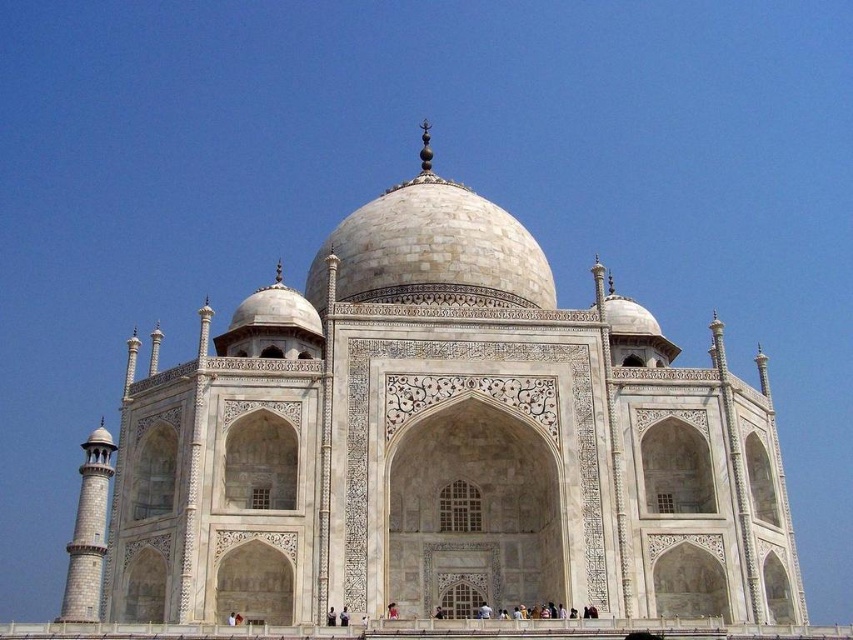
Looking at this image, which is more to the left, white marble taj mahal at center or red fabric person at center?

From the viewer's perspective, white marble taj mahal at center appears more on the left side.

Consider the image. Which is below, white marble taj mahal at center or red fabric person at center?

red fabric person at center is below.

The width and height of the screenshot is (853, 640). I want to click on white marble taj mahal at center, so click(x=434, y=445).

Which of these two, white marble taj mahal at center or smooth white person at center, stands taller?

white marble taj mahal at center

Can you confirm if white marble taj mahal at center is positioned below smooth white person at center?

Incorrect, white marble taj mahal at center is not positioned below smooth white person at center.

Is point (653, 584) positioned after point (339, 612)?

Yes, point (653, 584) is farther from viewer.

Locate an element on the screen. This screenshot has height=640, width=853. white marble taj mahal at center is located at coordinates (434, 445).

Is red fabric person at center above smooth white person at center?

No, red fabric person at center is not above smooth white person at center.

Who is positioned more to the right, red fabric person at center or smooth white person at center?

From the viewer's perspective, red fabric person at center appears more on the right side.

Describe the element at coordinates (392, 611) in the screenshot. Image resolution: width=853 pixels, height=640 pixels. I see `red fabric person at center` at that location.

Image resolution: width=853 pixels, height=640 pixels. I want to click on red fabric person at center, so click(x=392, y=611).